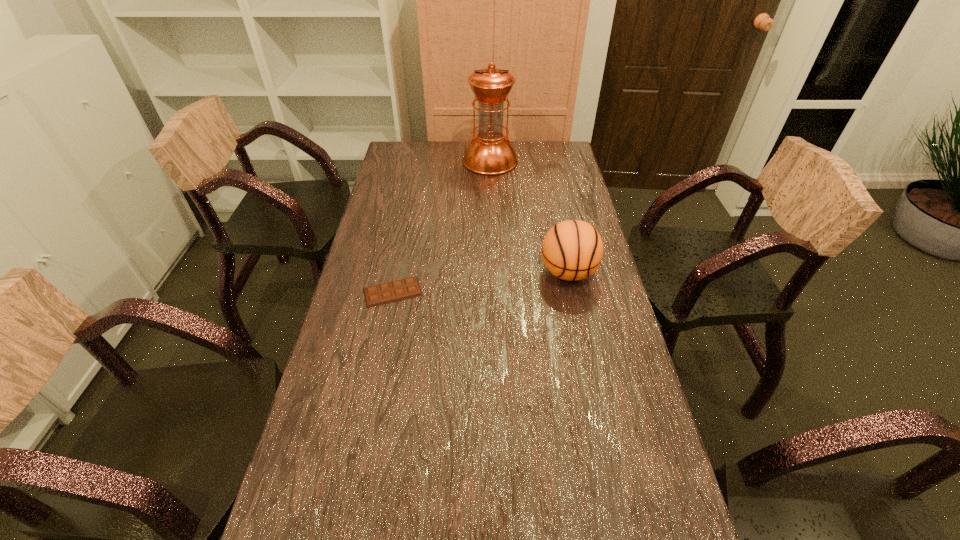
Where is `oil lamp`? The height and width of the screenshot is (540, 960). oil lamp is located at coordinates (490, 152).

Image resolution: width=960 pixels, height=540 pixels. In order to click on the farthest object in this screenshot , I will do `click(490, 152)`.

Locate an element on the screen. The width and height of the screenshot is (960, 540). the rightmost object is located at coordinates (572, 250).

I want to click on the second shortest object, so click(572, 250).

This screenshot has width=960, height=540. Find the location of `the leftmost object`. the leftmost object is located at coordinates (380, 294).

What are the coordinates of `the shortest object` in the screenshot? It's located at [x=380, y=294].

Locate an element on the screen. free space located 0.230m on the right of the oil lamp is located at coordinates (571, 161).

The image size is (960, 540). What are the coordinates of `vacant space situated on the front of the second shortest object` in the screenshot? It's located at (583, 343).

The width and height of the screenshot is (960, 540). I want to click on vacant area situated 0.400m on the front of the leftmost object, so (363, 440).

Identify the location of object positioned at the far edge. (x=490, y=152).